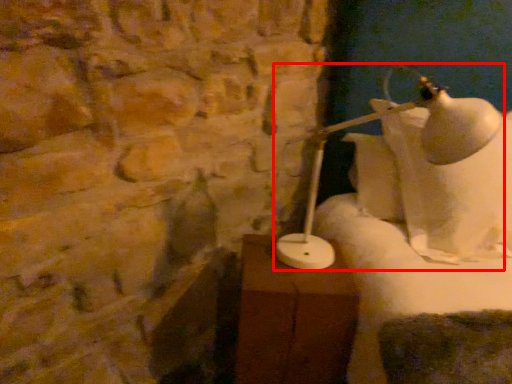
Question: From the image's perspective, what is the correct spatial positioning of lamp (annotated by the red box) in reference to table?

Choices:
 (A) below
 (B) above

Answer: (B)